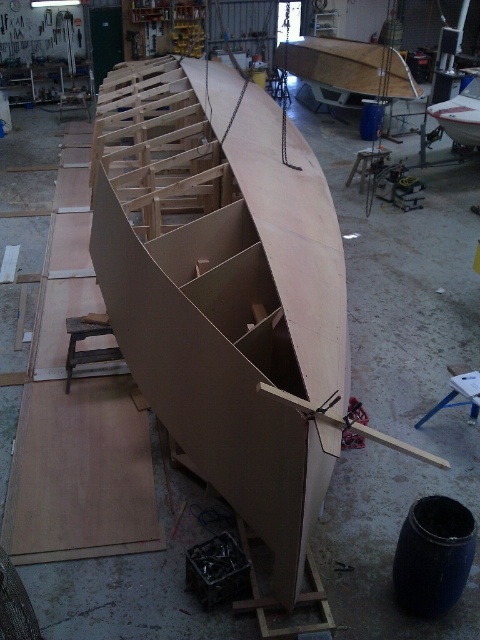
Which is in front, point (184, 246) or point (444, 124)?

Positioned in front is point (184, 246).

Can you confirm if light brown wood boat at center is bigger than matte wood boat at center?

Actually, light brown wood boat at center might be smaller than matte wood boat at center.

Describe the element at coordinates (228, 298) in the screenshot. The width and height of the screenshot is (480, 640). I see `light brown wood boat at center` at that location.

The image size is (480, 640). Identify the location of light brown wood boat at center. (228, 298).